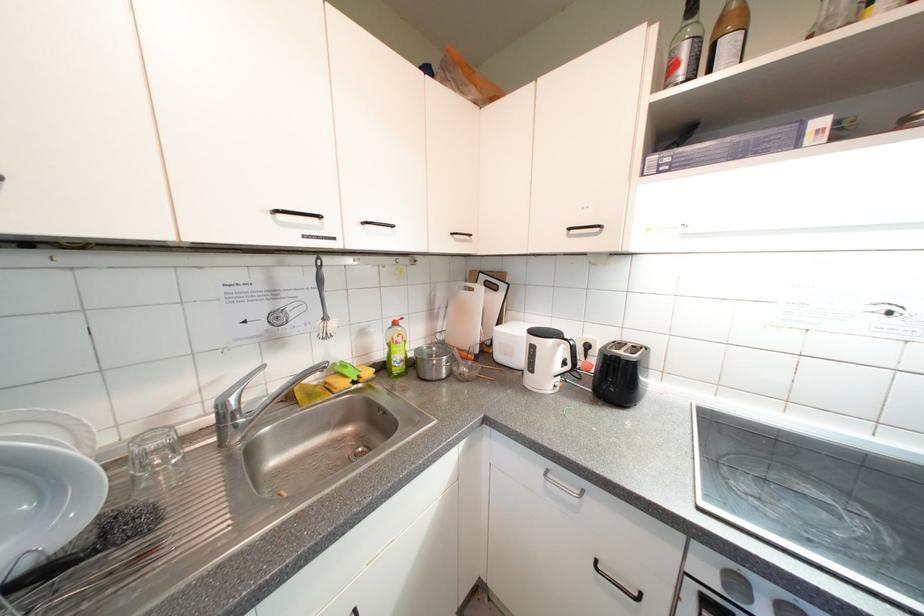
Describe the element at coordinates (570, 360) in the screenshot. I see `the white kettle handle` at that location.